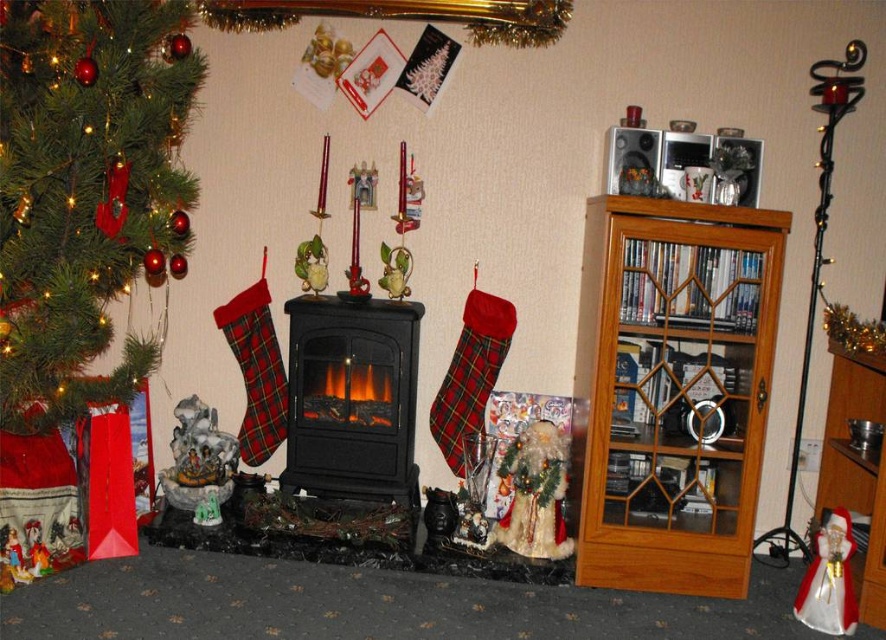
You are standing in the living room and want to place a new book on the light brown wooden bookshelf at right. However, you notice the green matte christmas tree at left is in your way. Can you walk around the tree to reach the bookshelf?

The light brown wooden bookshelf at right is further to the viewer than the green matte christmas tree at left, meaning the bookshelf is closer to you. Since the tree is behind the bookshelf, you can easily walk around the tree to reach the bookshelf without obstruction.

Looking at this image, you are standing in the living room and want to reach both points. Which point, point (654, 381) or point (179, 100), will you reach first?

You will reach point (179, 100) first because it is closer to you than point (654, 381), which is further away.